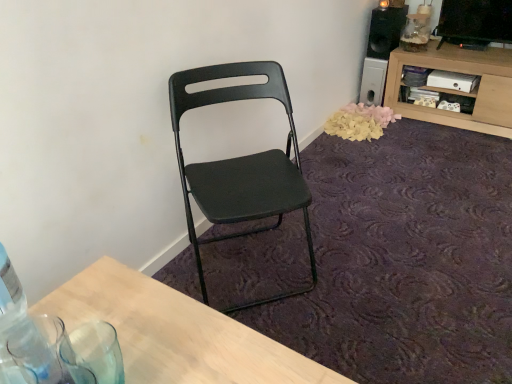
Where is `vacant space in between matte black folding chair at center and yellow paper petals at lower right`? Image resolution: width=512 pixels, height=384 pixels. vacant space in between matte black folding chair at center and yellow paper petals at lower right is located at coordinates (332, 186).